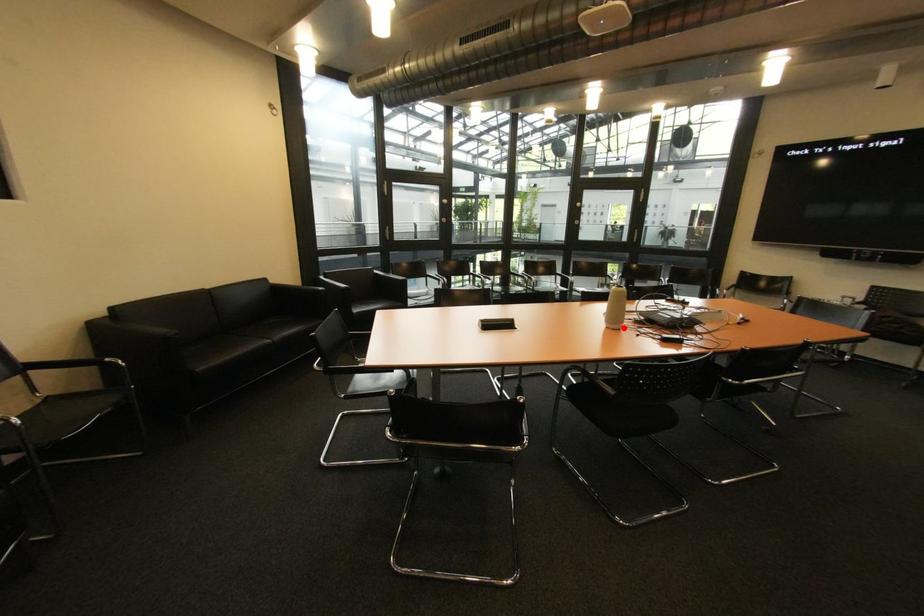
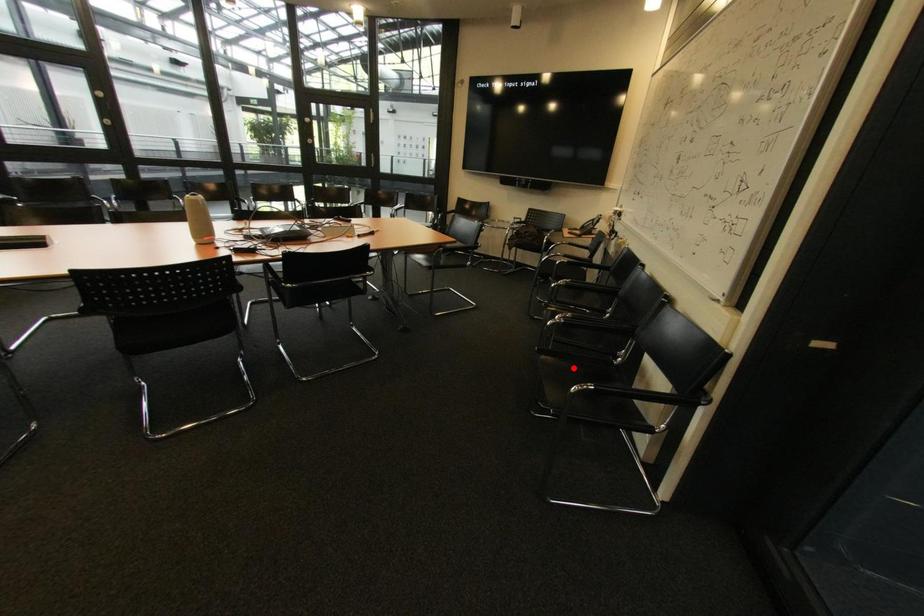
I am providing you with two images of the same scene from different viewpoints. A red point is marked on the first image and another point is marked on the second image. Are the points marked in image1 and image2 representing the same 3D position?

No